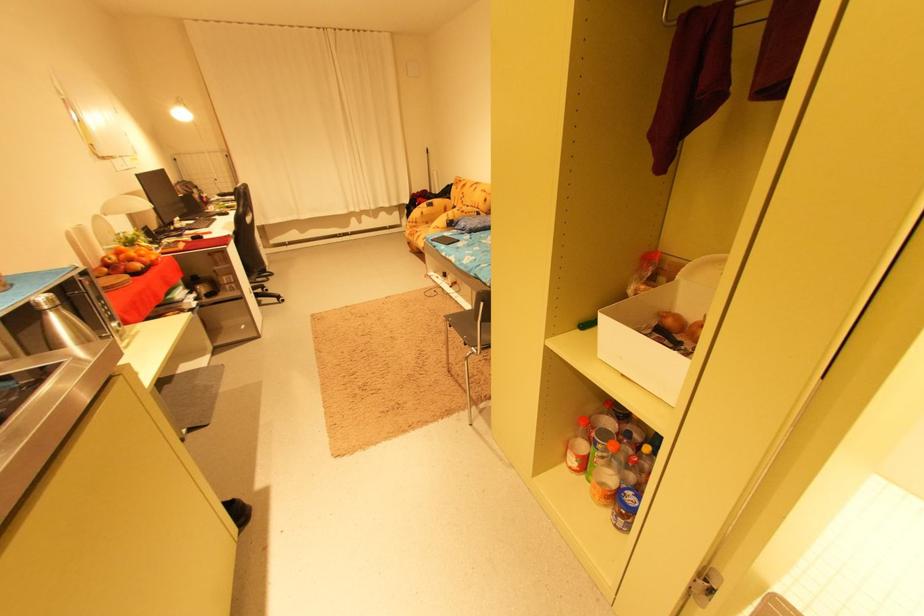
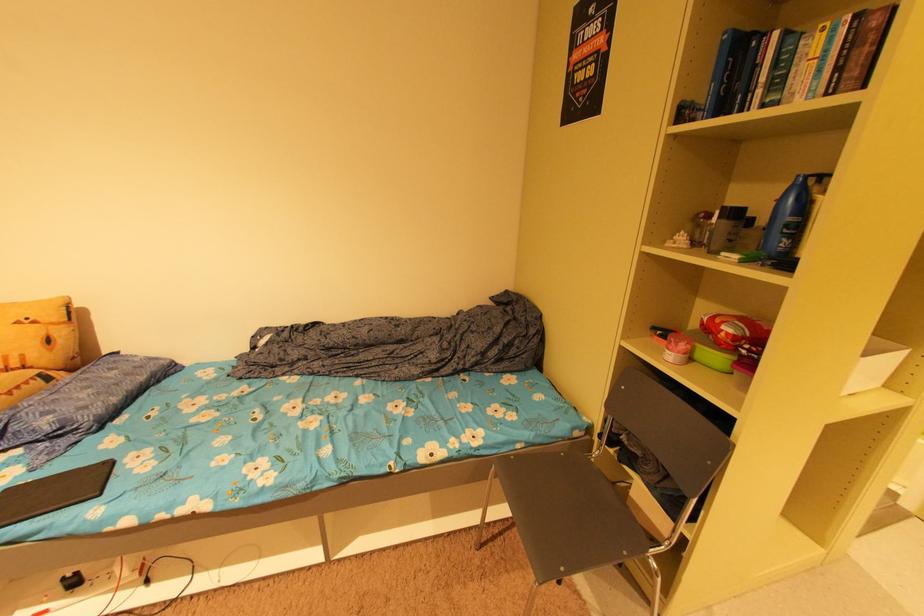
In the second image, find the point that corresponds to (489,191) in the first image.

(23, 323)